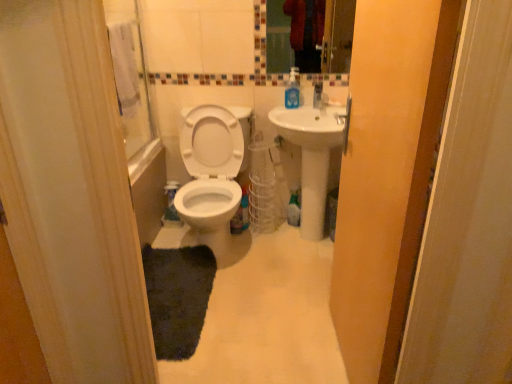
Where is `vacant area in front of white ceramic sink at center`? vacant area in front of white ceramic sink at center is located at coordinates (297, 278).